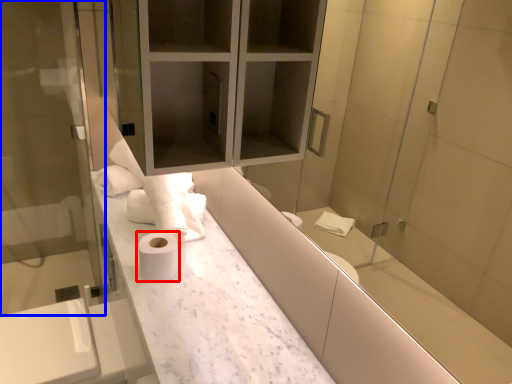
Question: Which of the following is the closest to the observer, toilet paper (highlighted by a red box) or screen door (highlighted by a blue box)?

Choices:
 (A) toilet paper
 (B) screen door

Answer: (A)